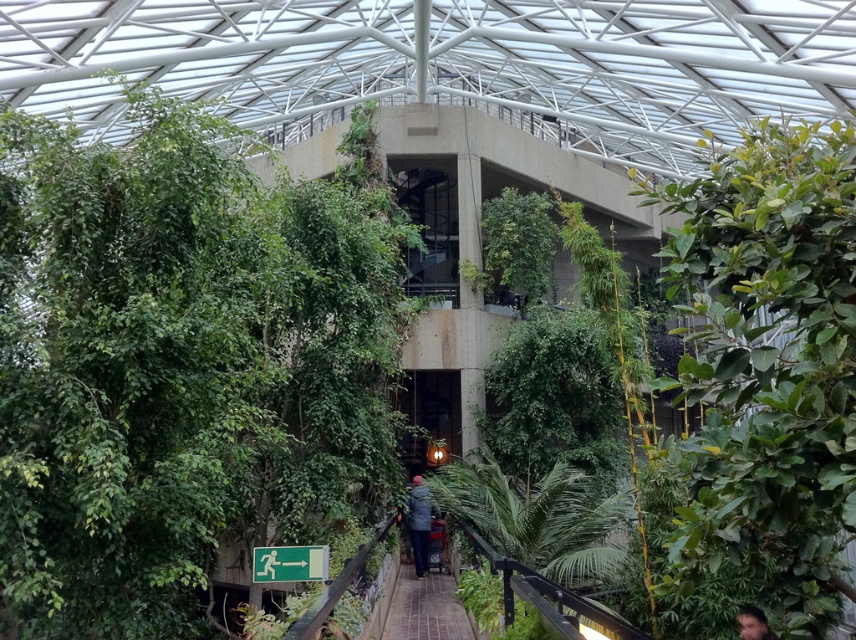
You are standing in the greenhouse and see the dark gray fabric jacket at center. Where exactly is the jacket positioned in relation to the concrete column at the center?

The dark gray fabric jacket at center is located at point (419, 522), which is slightly to the right and above the concrete column at the center.

You are a gardener who wants to water the green leafy tree at right and the brick paved walkway at center. Since you have a limited amount of water, you need to prioritize. Which object is closer to you so you can water it first?

The brick paved walkway at center is closer to you than the green leafy tree at right, so you should water the brick paved walkway at center first.

You are walking along the walkway in the greenhouse and want to take a closer look at both the green leafy tree at left and the green leafy tree at right. Which tree should you approach first if you want to reach the one closer to you first?

You should approach the green leafy tree at left first because it is closer to you than the green leafy tree at right.